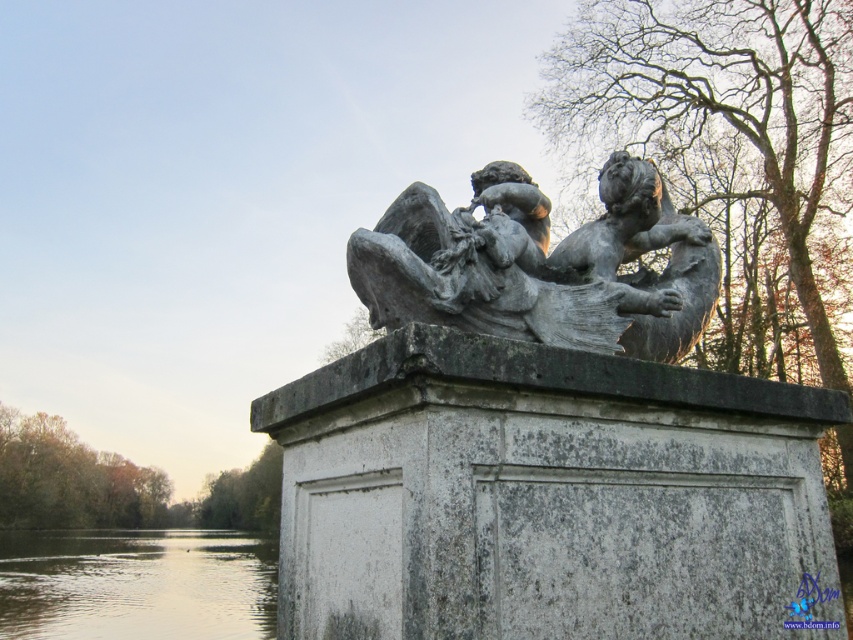
Consider the image. Is gray stone cherubim at center further to camera compared to smooth water at lower left?

No, gray stone cherubim at center is in front of smooth water at lower left.

Where is `gray stone cherubim at center`? The image size is (853, 640). gray stone cherubim at center is located at coordinates (541, 264).